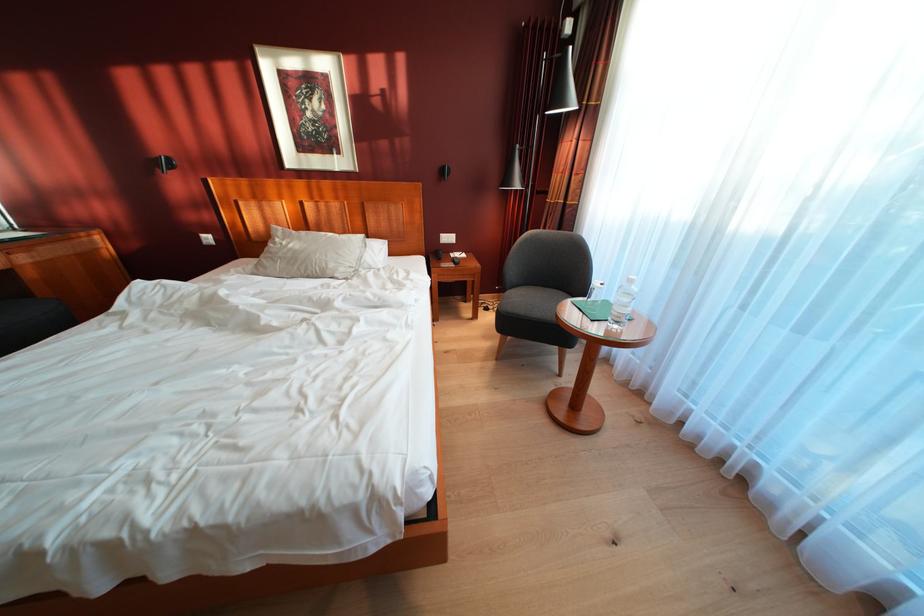
Identify the location of white light switch. (446, 238).